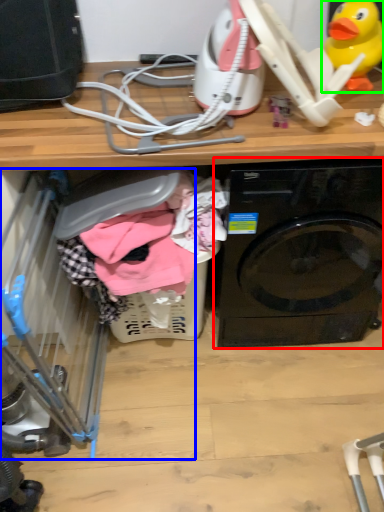
Question: Estimate the real-world distances between objects in this image. Which object is closer to washing machine (highlighted by a red box), baby carriage (highlighted by a blue box) or toy (highlighted by a green box)?

Choices:
 (A) baby carriage
 (B) toy

Answer: (B)